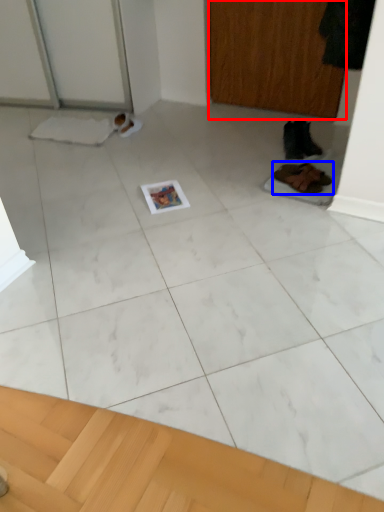
Question: Among these objects, which one is nearest to the camera, screen door (highlighted by a red box) or footwear (highlighted by a blue box)?

Choices:
 (A) screen door
 (B) footwear

Answer: (B)